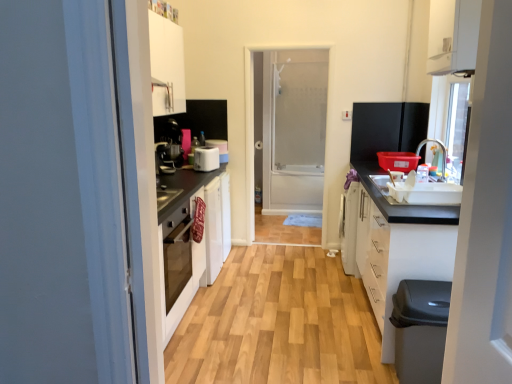
Question: From the image's perspective, is matte black coffee machine at center-left positioned above or below black plastic dishwasher at lower right?

Choices:
 (A) above
 (B) below

Answer: (A)

Question: Looking at their shapes, would you say matte black coffee machine at center-left is wider or thinner than black plastic dishwasher at lower right?

Choices:
 (A) wide
 (B) thin

Answer: (B)

Question: Which of these objects is positioned farthest from the white plastic toaster at center?

Choices:
 (A) white matte cabinet at lower right, acting as the second cabinetry starting from the top
 (B) transparent glass screen door at center
 (C) wooden floor at center
 (D) black plastic dishwasher at lower right
 (E) matte black coffee machine at center-left

Answer: (B)

Question: Which object is positioned closest to the transparent glass screen door at center?

Choices:
 (A) wooden floor at center
 (B) black plastic dishwasher at lower right
 (C) matte black coffee machine at center-left
 (D) white plastic toaster at center
 (E) white matte cabinet at lower right, acting as the second cabinetry starting from the top

Answer: (C)